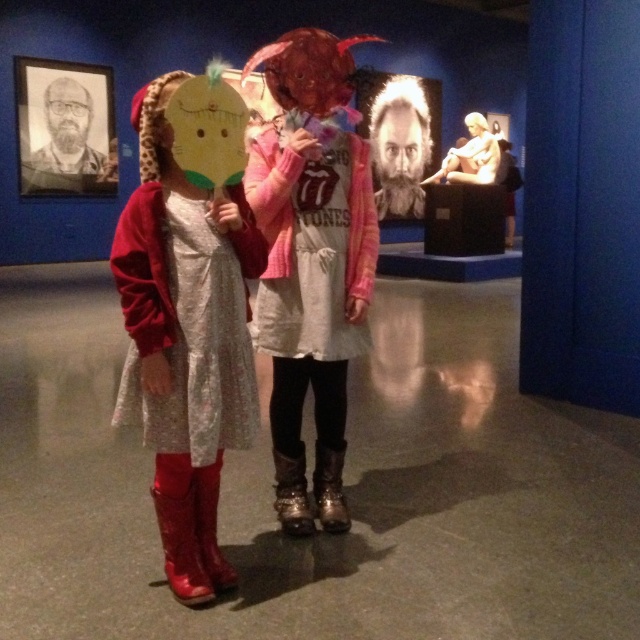
Question: Which point is farther to the camera?

Choices:
 (A) (289, 508)
 (B) (76, 177)
 (C) (196, 467)
 (D) (168, 492)

Answer: (B)

Question: Which of the following is the farthest from the observer?

Choices:
 (A) (184, 337)
 (B) (333, 488)
 (C) (397, 134)
 (D) (193, 477)

Answer: (C)

Question: Considering the relative positions of shiny red boots at left and leather boots at center in the image provided, where is shiny red boots at left located with respect to leather boots at center?

Choices:
 (A) right
 (B) left

Answer: (B)

Question: Which point is farther to the camera?

Choices:
 (A) (180, 257)
 (B) (67, 83)
 (C) (388, 106)

Answer: (C)

Question: Can you confirm if shiny red boots at left is wider than shiny metallic boot at lower left?

Choices:
 (A) yes
 (B) no

Answer: (A)

Question: Is the position of shiny red boots at left more distant than that of bearded hair at center?

Choices:
 (A) yes
 (B) no

Answer: (B)